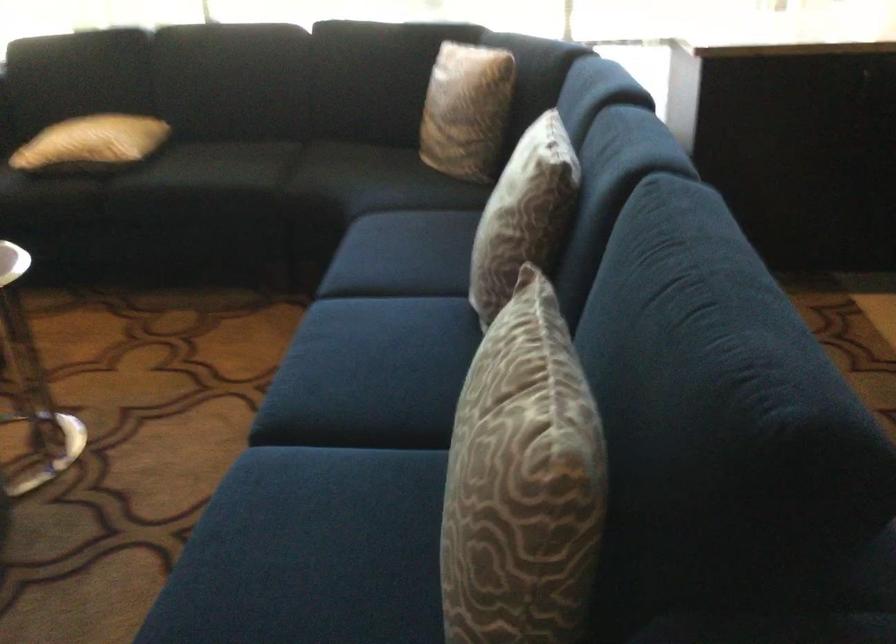
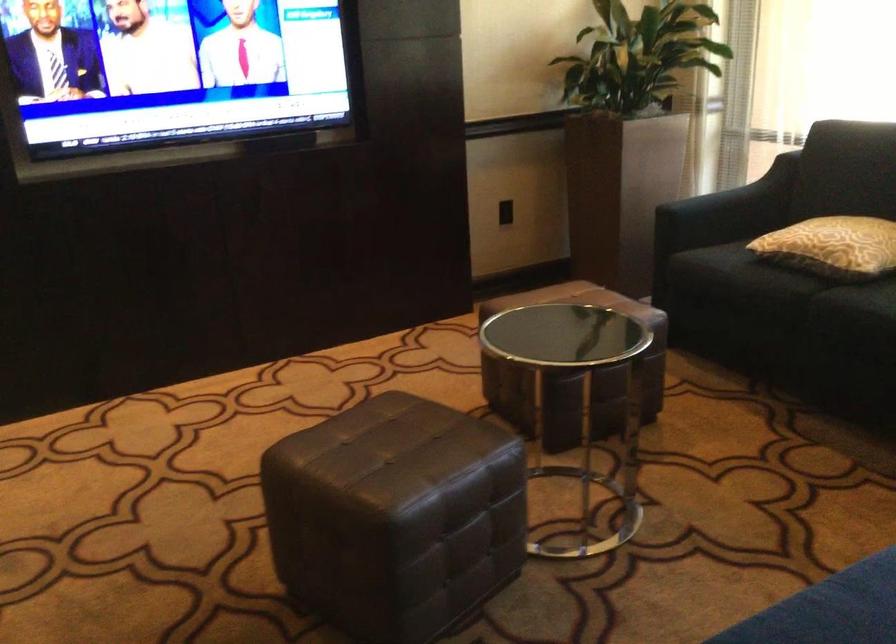
The point at (97,147) is marked in the first image. Where is the corresponding point in the second image?

(832, 245)